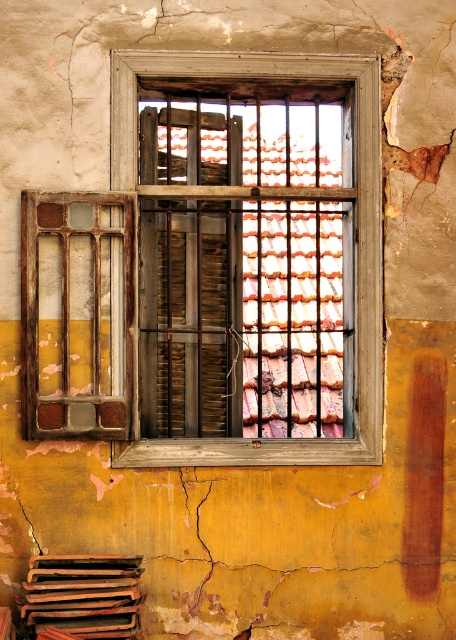
Question: Can you confirm if wooden frame at center is positioned above rusty metal shutter at left?

Choices:
 (A) no
 (B) yes

Answer: (B)

Question: Does wooden frame at center appear over rusty metal shutter at left?

Choices:
 (A) yes
 (B) no

Answer: (A)

Question: Does wooden frame at center appear over rusty metal shutter at left?

Choices:
 (A) yes
 (B) no

Answer: (A)

Question: Which point appears farthest from the camera in this image?

Choices:
 (A) click(364, 362)
 (B) click(98, 282)

Answer: (A)

Question: Among these points, which one is farthest from the camera?

Choices:
 (A) (31, 298)
 (B) (112, 138)

Answer: (B)

Question: Which object appears farthest from the camera in this image?

Choices:
 (A) wooden frame at center
 (B) rusty metal shutter at left

Answer: (A)